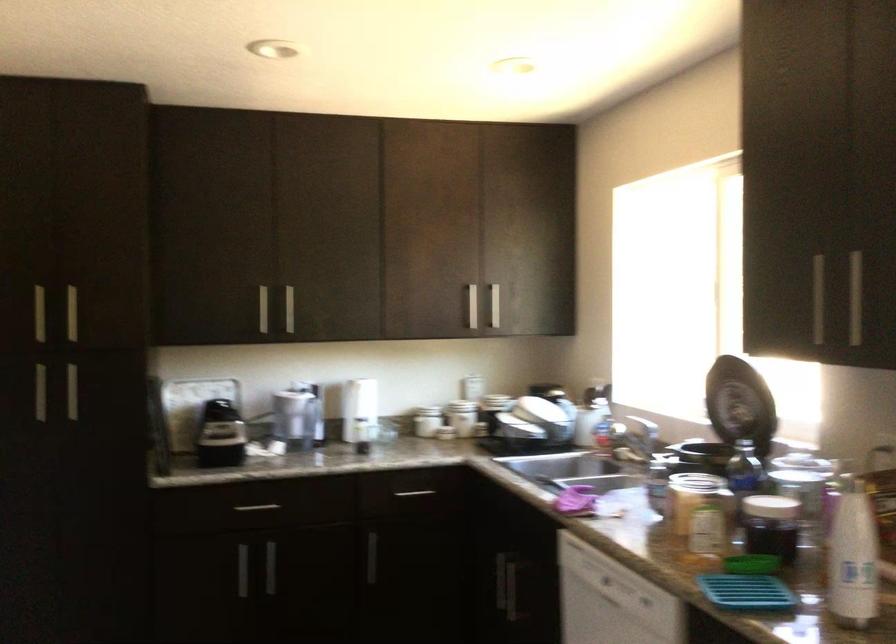
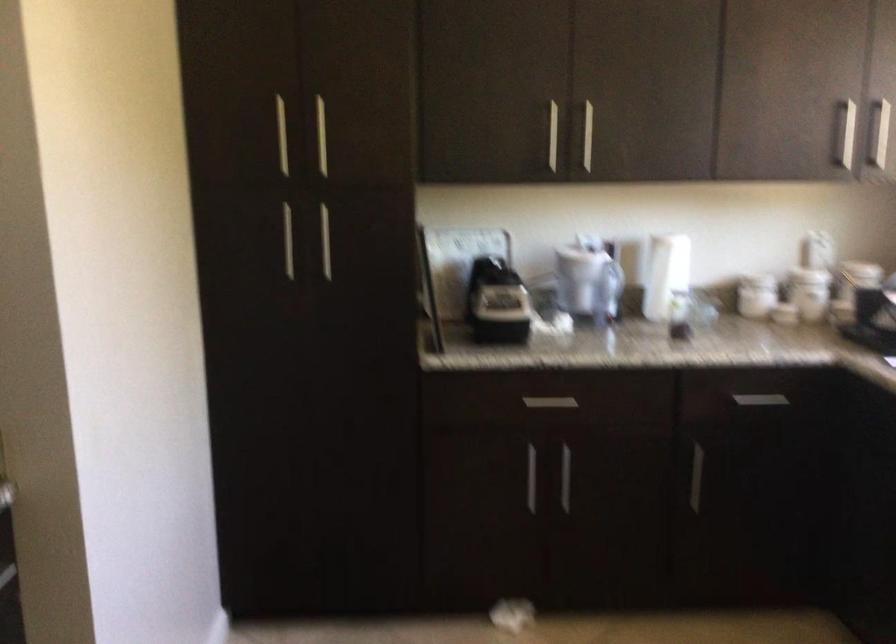
The point at (263, 308) is marked in the first image. Where is the corresponding point in the second image?

(552, 136)